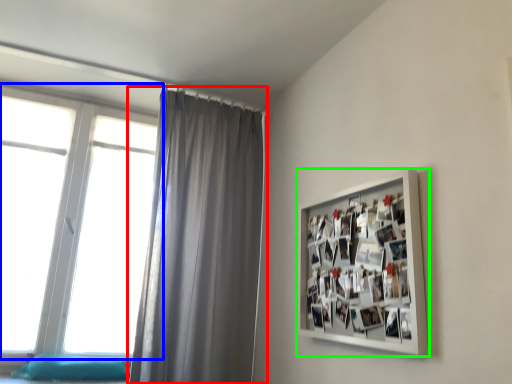
Question: Which object is positioned closest to curtain (highlighted by a red box)? Select from window (highlighted by a blue box) and picture frame (highlighted by a green box).

Choices:
 (A) window
 (B) picture frame

Answer: (A)